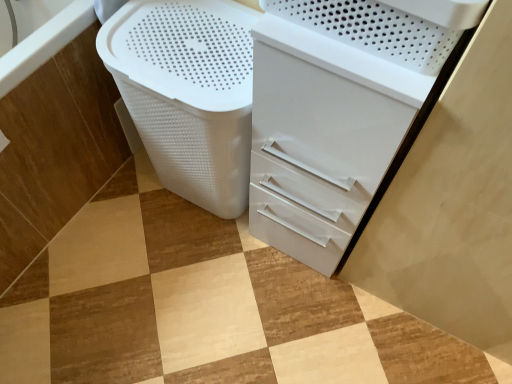
You are a GUI agent. You are given a task and a screenshot of the screen. Output one action in this format:
    pyautogui.click(x=<x>, y=<y>)
    Task: Click on the free space in front of white plastic basket at lower left
    The height and width of the screenshot is (384, 512).
    Given the screenshot: What is the action you would take?
    pyautogui.click(x=84, y=293)